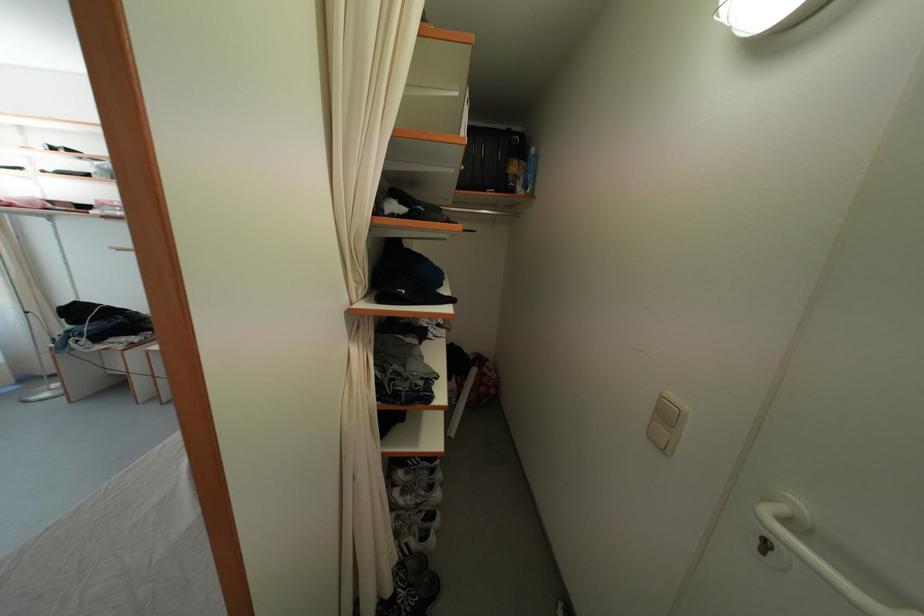
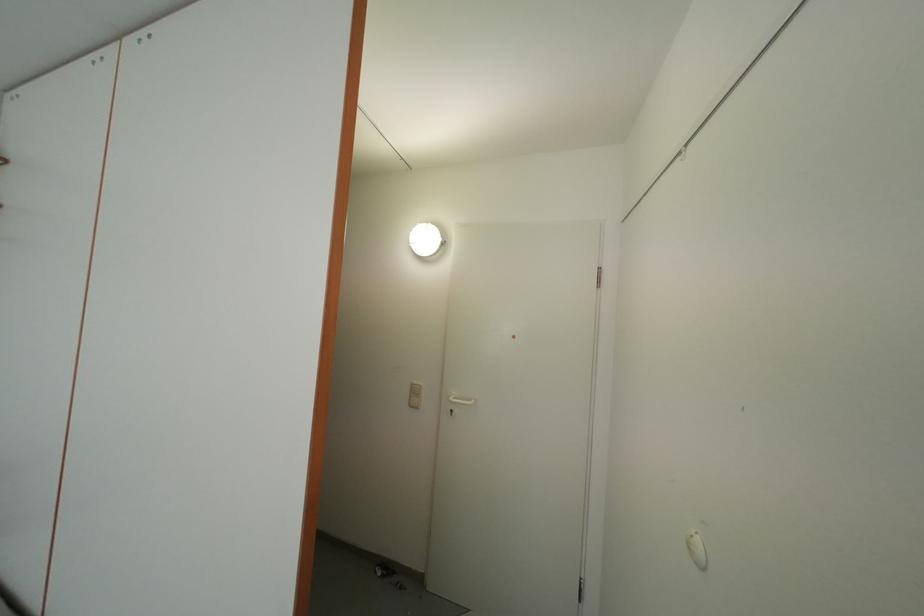
Question: The camera is either moving clockwise (left) or counter-clockwise (right) around the object. The first image is from the beginning of the video and the second image is from the end. Is the camera moving left or right when shooting the video?

Choices:
 (A) Left
 (B) Right

Answer: (A)